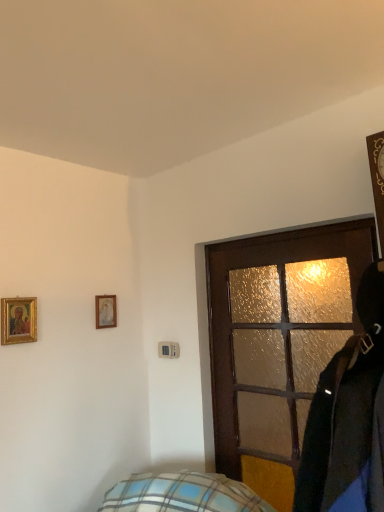
Question: Is brown textured door at center oriented away from matte white picture frame at upper left, the second picture frame from the front?

Choices:
 (A) yes
 (B) no

Answer: (B)

Question: Is brown textured door at center positioned before matte white picture frame at upper left, the first picture frame when ordered from back to front?

Choices:
 (A) no
 (B) yes

Answer: (B)

Question: Does brown textured door at center have a lesser width compared to matte white picture frame at upper left, the second picture frame from the left?

Choices:
 (A) yes
 (B) no

Answer: (B)

Question: Is brown textured door at center next to matte white picture frame at upper left, which is the 1th picture frame from right to left?

Choices:
 (A) yes
 (B) no

Answer: (B)

Question: Could matte white picture frame at upper left, the first picture frame when ordered from back to front, be considered to be inside brown textured door at center?

Choices:
 (A) yes
 (B) no

Answer: (B)

Question: Is gold-framed picture at upper left, the first picture frame from the left, bigger or smaller than brown textured door at center?

Choices:
 (A) big
 (B) small

Answer: (B)

Question: Choose the correct answer: Is gold-framed picture at upper left, the first picture frame positioned from the front, inside brown textured door at center or outside it?

Choices:
 (A) outside
 (B) inside

Answer: (A)

Question: From a real-world perspective, relative to brown textured door at center, is gold-framed picture at upper left, marked as the second picture frame in a back-to-front arrangement, vertically above or below?

Choices:
 (A) below
 (B) above

Answer: (B)

Question: Does point (1, 330) appear closer or farther from the camera than point (309, 373)?

Choices:
 (A) farther
 (B) closer

Answer: (A)

Question: Would you say matte white picture frame at upper left, the second picture frame from the front, is to the left or to the right of gold-framed picture at upper left, marked as the second picture frame in a back-to-front arrangement, in the picture?

Choices:
 (A) left
 (B) right

Answer: (B)

Question: From the image's perspective, is matte white picture frame at upper left, the second picture frame from the front, positioned above or below gold-framed picture at upper left, marked as the second picture frame in a back-to-front arrangement?

Choices:
 (A) below
 (B) above

Answer: (A)

Question: Is matte white picture frame at upper left, the second picture frame from the left, bigger or smaller than gold-framed picture at upper left, marked as the second picture frame in a back-to-front arrangement?

Choices:
 (A) small
 (B) big

Answer: (A)

Question: Looking at their shapes, would you say matte white picture frame at upper left, the second picture frame from the left, is wider or thinner than gold-framed picture at upper left, marked as the second picture frame in a back-to-front arrangement?

Choices:
 (A) thin
 (B) wide

Answer: (A)

Question: Is point (105, 294) closer or farther from the camera than point (288, 324)?

Choices:
 (A) closer
 (B) farther

Answer: (B)

Question: From the image's perspective, is matte white picture frame at upper left, the second picture frame from the left, above or below brown textured door at center?

Choices:
 (A) below
 (B) above

Answer: (B)